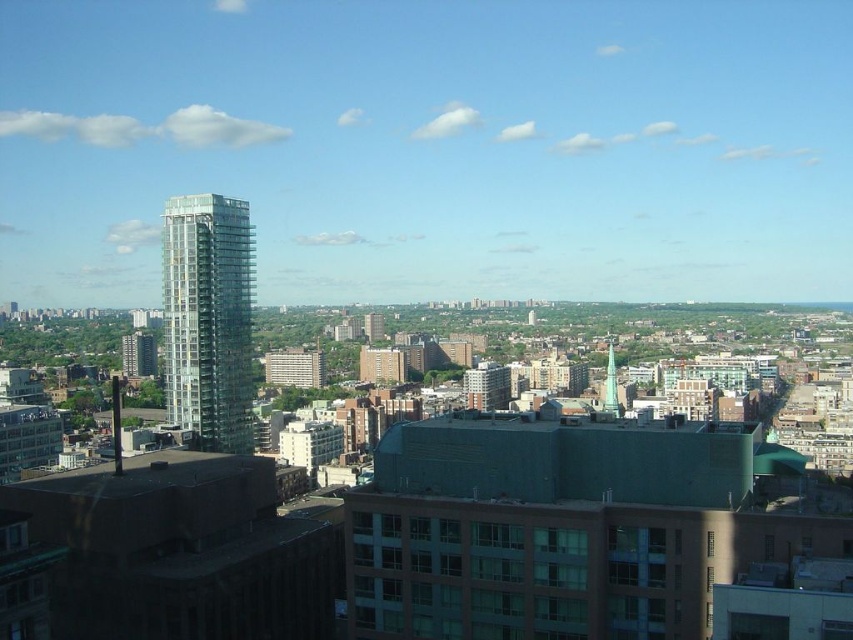
You are a GUI agent. You are given a task and a screenshot of the screen. Output one action in this format:
    pyautogui.click(x=<x>, y=<y>)
    Task: Click on the transparent glass tower at left
    The height and width of the screenshot is (640, 853).
    Given the screenshot: What is the action you would take?
    pyautogui.click(x=207, y=320)

Does point (241, 308) come farther from viewer compared to point (607, 349)?

That is False.

Where is `transparent glass tower at left`? transparent glass tower at left is located at coordinates (207, 320).